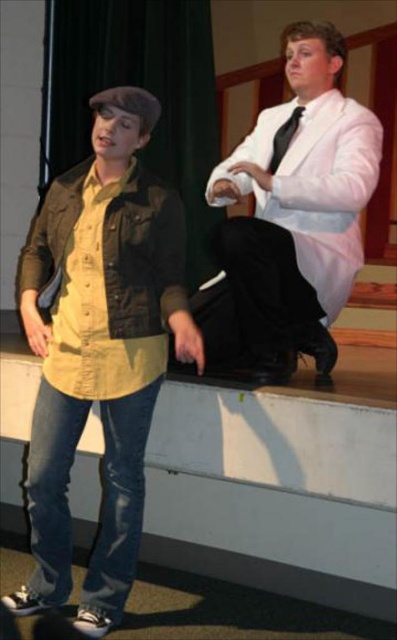
You are a stagehand setting up a new spotlight. You need to determine which point is closer to the audience to direct the light properly. Which point is closer to the audience between point [213,445] and point [248,234]?

Point [213,445] is further to the viewer than point [248,234], so the closer point to the audience would be point [248,234].

You are a stagehand who needs to place a 2.5 meter long extension cord from the camera position to the smooth concrete ledge at lower center. Can the extension cord reach the ledge?

The smooth concrete ledge at lower center is 2.44 meters away from the camera. Since the extension cord is 2.5 meters long, it can easily reach the ledge as it is slightly longer than the distance required.

You are a stagehand setting up for a performance. You need to ensure that the black satin tie at upper right is visible to the audience. Given that the matte khaki lab coat at left is currently blocking it, what should you do?

The matte khaki lab coat at left is in front of the black satin tie at upper right, so you should move the matte khaki lab coat at left to the side to ensure the black satin tie at upper right is visible to the audience.